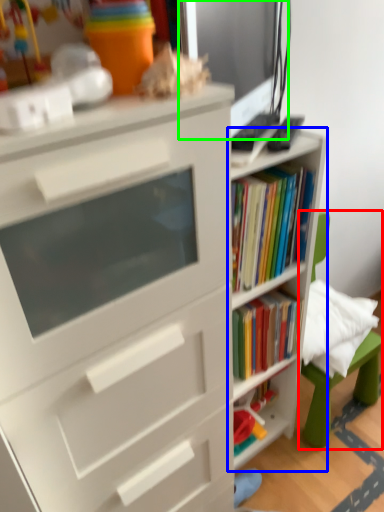
Question: Based on their relative distances, which object is farther from swivel chair (highlighted by a red box)? Choose from shelf (highlighted by a blue box) and computer monitor (highlighted by a green box).

Choices:
 (A) shelf
 (B) computer monitor

Answer: (B)